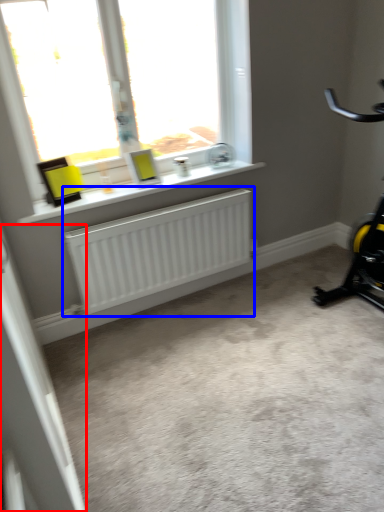
Question: Which point is further to the camera, screen door (highlighted by a red box) or radiator (highlighted by a blue box)?

Choices:
 (A) screen door
 (B) radiator

Answer: (B)